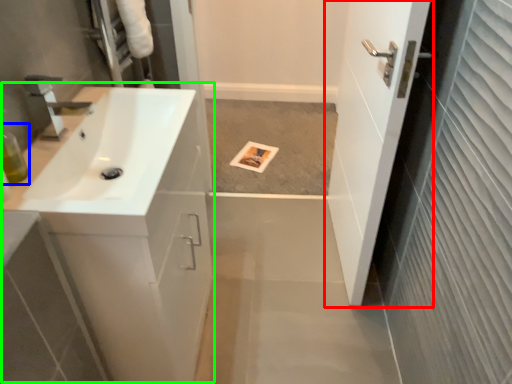
Question: Which object is the closest to the door (highlighted by a red box)? Choose among these: toiletry (highlighted by a blue box) or counter top (highlighted by a green box).

Choices:
 (A) toiletry
 (B) counter top

Answer: (B)